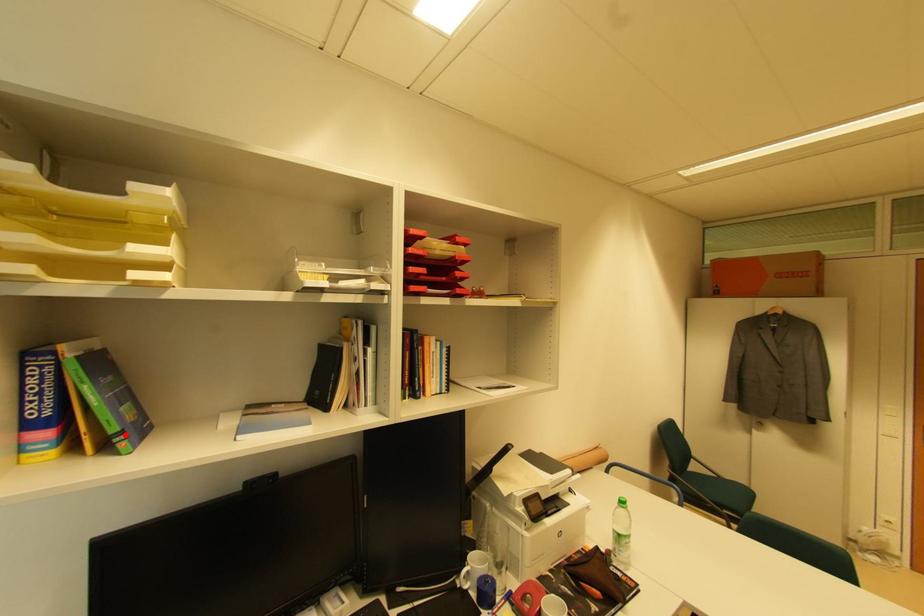
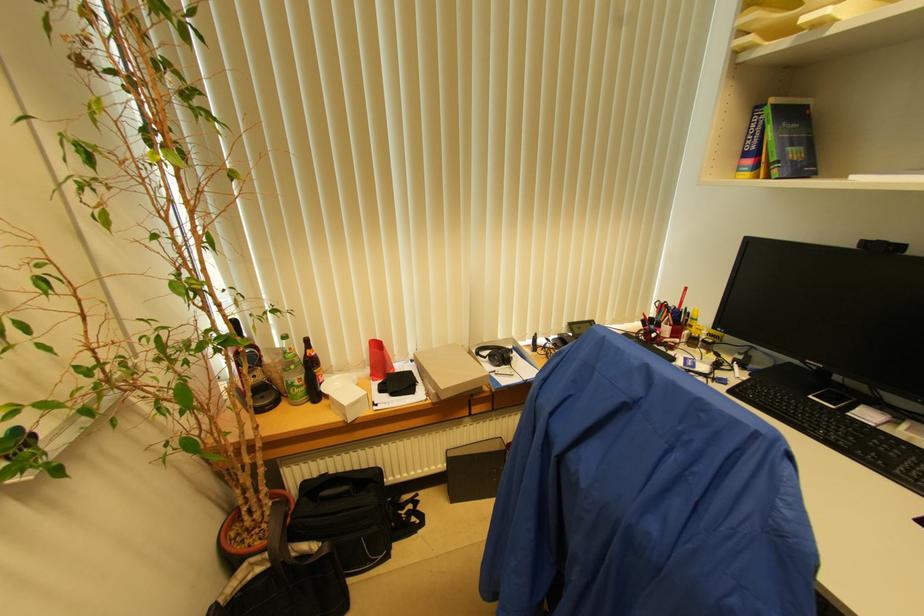
In the second image, find the point that corresponds to the highlighted location in the first image.

(780, 166)